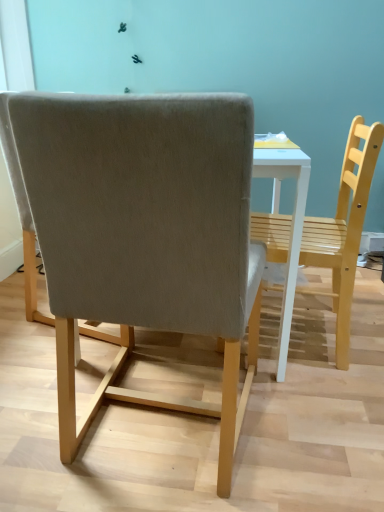
Question: Does light brown wooden chair at center, the second chair viewed from the left, contain light gray fabric chair at center, which is counted as the 1th chair, starting from the left?

Choices:
 (A) yes
 (B) no

Answer: (B)

Question: Can you confirm if light brown wooden chair at center, marked as the 1th chair in a right-to-left arrangement, is positioned to the left of light gray fabric chair at center, which appears as the second chair when viewed from the right?

Choices:
 (A) no
 (B) yes

Answer: (A)

Question: Considering the relative sizes of light brown wooden chair at center, marked as the 1th chair in a right-to-left arrangement, and light gray fabric chair at center, which appears as the second chair when viewed from the right, in the image provided, is light brown wooden chair at center, marked as the 1th chair in a right-to-left arrangement, taller than light gray fabric chair at center, which appears as the second chair when viewed from the right,?

Choices:
 (A) yes
 (B) no

Answer: (B)

Question: Would you consider light brown wooden chair at center, marked as the 1th chair in a right-to-left arrangement, to be distant from light gray fabric chair at center, which appears as the second chair when viewed from the right?

Choices:
 (A) yes
 (B) no

Answer: (B)

Question: From a real-world perspective, is light brown wooden chair at center, the second chair viewed from the left, beneath light gray fabric chair at center, which appears as the second chair when viewed from the right?

Choices:
 (A) yes
 (B) no

Answer: (A)

Question: Does light brown wooden chair at center, the second chair viewed from the left, appear on the right side of light gray fabric chair at center, which appears as the second chair when viewed from the right?

Choices:
 (A) no
 (B) yes

Answer: (B)

Question: Is light brown wooden chair at center, marked as the 1th chair in a right-to-left arrangement, inside light gray fabric chair at center, which appears as the second chair when viewed from the right?

Choices:
 (A) no
 (B) yes

Answer: (A)

Question: From a real-world perspective, is light gray fabric chair at center, which appears as the second chair when viewed from the right, under light brown wooden chair at center, marked as the 1th chair in a right-to-left arrangement?

Choices:
 (A) no
 (B) yes

Answer: (A)

Question: Is light gray fabric chair at center, which appears as the second chair when viewed from the right, at the left side of light brown wooden chair at center, the second chair viewed from the left?

Choices:
 (A) yes
 (B) no

Answer: (A)

Question: Considering the relative sizes of light gray fabric chair at center, which is counted as the 1th chair, starting from the left, and light brown wooden chair at center, marked as the 1th chair in a right-to-left arrangement, in the image provided, is light gray fabric chair at center, which is counted as the 1th chair, starting from the left, taller than light brown wooden chair at center, marked as the 1th chair in a right-to-left arrangement,?

Choices:
 (A) yes
 (B) no

Answer: (A)

Question: From the image's perspective, does light gray fabric chair at center, which is counted as the 1th chair, starting from the left, appear higher than light brown wooden chair at center, marked as the 1th chair in a right-to-left arrangement?

Choices:
 (A) no
 (B) yes

Answer: (A)

Question: Considering the relative sizes of light gray fabric chair at center, which is counted as the 1th chair, starting from the left, and light brown wooden chair at center, marked as the 1th chair in a right-to-left arrangement, in the image provided, is light gray fabric chair at center, which is counted as the 1th chair, starting from the left, smaller than light brown wooden chair at center, marked as the 1th chair in a right-to-left arrangement,?

Choices:
 (A) no
 (B) yes

Answer: (A)

Question: Is light gray fabric chair at center, which appears as the second chair when viewed from the right, inside or outside of light brown wooden chair at center, the second chair viewed from the left?

Choices:
 (A) inside
 (B) outside

Answer: (B)